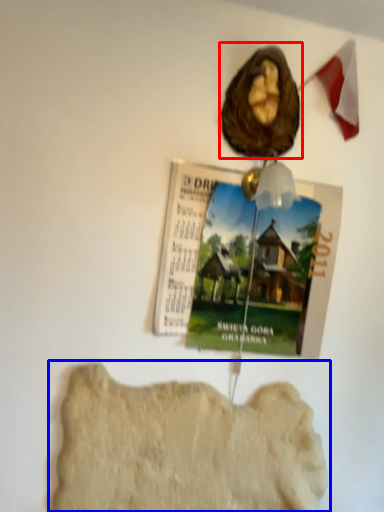
Question: Among these objects, which one is farthest to the camera, art (highlighted by a red box) or rock formation (highlighted by a blue box)?

Choices:
 (A) art
 (B) rock formation

Answer: (A)